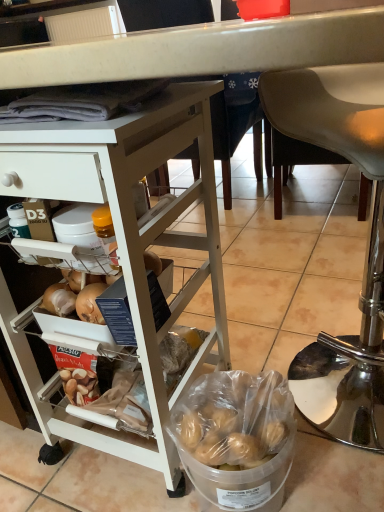
Where is `clear plastic bucket at lower center`? The width and height of the screenshot is (384, 512). clear plastic bucket at lower center is located at coordinates (236, 437).

What do you see at coordinates (236, 437) in the screenshot? This screenshot has height=512, width=384. I see `clear plastic bucket at lower center` at bounding box center [236, 437].

The width and height of the screenshot is (384, 512). Describe the element at coordinates (366, 246) in the screenshot. I see `metallic silver chair at lower right` at that location.

Find the location of a particular element. clear plastic bucket at lower center is located at coordinates (236, 437).

From the image's perspective, which one is positioned higher, metallic silver chair at lower right or clear plastic bucket at lower center?

metallic silver chair at lower right, from the image's perspective.

Does point (318, 409) come closer to viewer compared to point (266, 470)?

No, it is behind (266, 470).

Which object is further away from the camera taking this photo, metallic silver chair at lower right or clear plastic bucket at lower center?

clear plastic bucket at lower center is more distant.

Between point (294, 131) and point (22, 163), which one is positioned in front?

The point (22, 163) is in front.

In the image, is metallic silver chair at lower right on the left side or the right side of white matte desk at upper left?

metallic silver chair at lower right is positioned on white matte desk at upper left's right side.

Does metallic silver chair at lower right have a lesser width compared to white matte desk at upper left?

Correct, the width of metallic silver chair at lower right is less than that of white matte desk at upper left.

Which of these two, clear plastic bucket at lower center or metallic silver chair at lower right, is wider?

With larger width is metallic silver chair at lower right.

Is clear plastic bucket at lower center oriented away from metallic silver chair at lower right?

Yes, clear plastic bucket at lower center's orientation is away from metallic silver chair at lower right.

Is clear plastic bucket at lower center closer to camera compared to metallic silver chair at lower right?

No, it is not.

From a real-world perspective, between white matte desk at upper left and metallic silver chair at lower right, who is vertically lower?

metallic silver chair at lower right, from a real-world perspective.

How much distance is there between white matte desk at upper left and metallic silver chair at lower right?

white matte desk at upper left and metallic silver chair at lower right are 13.26 inches apart.

How many degrees apart are the facing directions of white matte desk at upper left and metallic silver chair at lower right?

white matte desk at upper left and metallic silver chair at lower right are facing 34.4 degrees away from each other.

Is point (98, 183) positioned before point (376, 149)?

Yes.

Are white matte desk at upper left and clear plastic bucket at lower center beside each other?

No, white matte desk at upper left is not next to clear plastic bucket at lower center.

From a real-world perspective, who is located lower, white matte desk at upper left or clear plastic bucket at lower center?

clear plastic bucket at lower center.

Is white matte desk at upper left oriented away from clear plastic bucket at lower center?

white matte desk at upper left does not have its back to clear plastic bucket at lower center.

Does clear plastic bucket at lower center have a greater width compared to white matte desk at upper left?

No.

In the scene shown: Does clear plastic bucket at lower center have a smaller size compared to white matte desk at upper left?

Yes.

From their relative heights in the image, would you say clear plastic bucket at lower center is taller or shorter than white matte desk at upper left?

Clearly, clear plastic bucket at lower center is shorter compared to white matte desk at upper left.

Is clear plastic bucket at lower center looking in the opposite direction of white matte desk at upper left?

No, clear plastic bucket at lower center is not facing the opposite direction of white matte desk at upper left.

Image resolution: width=384 pixels, height=512 pixels. Find the location of `bowl below the metallic silver chair at lower right (from a real-world perspective)`. bowl below the metallic silver chair at lower right (from a real-world perspective) is located at coordinates (236, 437).

Locate an element on the screen. desk positioned vertically above the metallic silver chair at lower right (from a real-world perspective) is located at coordinates (121, 250).

Estimate the real-world distances between objects in this image. Which object is closer to metallic silver chair at lower right, white matte desk at upper left or clear plastic bucket at lower center?

clear plastic bucket at lower center is positioned closer to the anchor metallic silver chair at lower right.

Estimate the real-world distances between objects in this image. Which object is further from metallic silver chair at lower right, clear plastic bucket at lower center or white matte desk at upper left?

white matte desk at upper left lies further to metallic silver chair at lower right than the other object.

Considering their positions, is clear plastic bucket at lower center positioned closer to white matte desk at upper left than metallic silver chair at lower right?

clear plastic bucket at lower center is positioned closer to the anchor white matte desk at upper left.

Which object lies further to the anchor point white matte desk at upper left, metallic silver chair at lower right or clear plastic bucket at lower center?

The object further to white matte desk at upper left is metallic silver chair at lower right.

From the image, which object appears to be nearer to clear plastic bucket at lower center, metallic silver chair at lower right or white matte desk at upper left?

Based on the image, white matte desk at upper left appears to be nearer to clear plastic bucket at lower center.

When comparing their distances from clear plastic bucket at lower center, does white matte desk at upper left or metallic silver chair at lower right seem closer?

white matte desk at upper left is positioned closer to the anchor clear plastic bucket at lower center.

I want to click on bowl located between white matte desk at upper left and metallic silver chair at lower right in the left-right direction, so click(x=236, y=437).